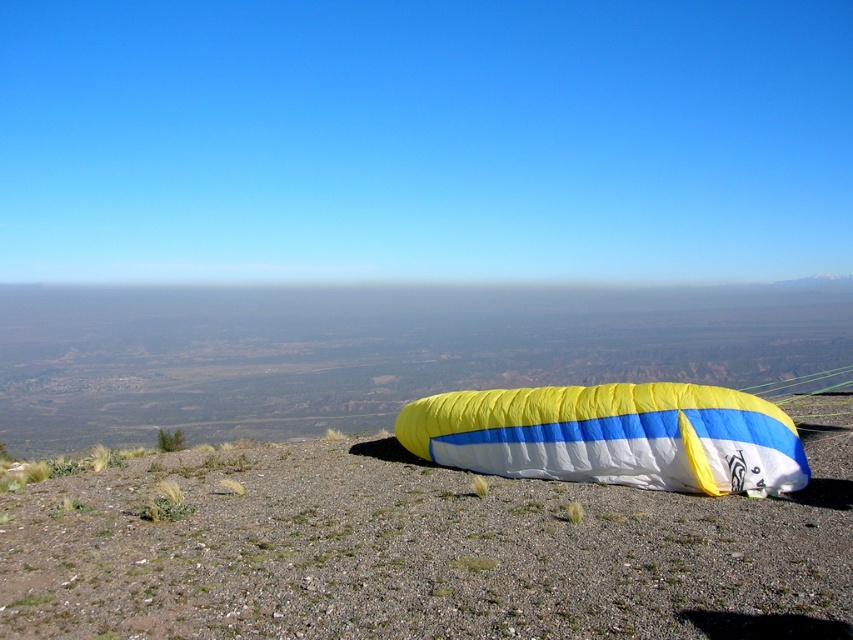
Question: Does yellow fabric parachute at center have a lesser width compared to yellow/white fabric parachute at lower right?

Choices:
 (A) yes
 (B) no

Answer: (A)

Question: Which point appears closest to the camera in this image?

Choices:
 (A) (164, 474)
 (B) (540, 388)

Answer: (B)

Question: Is yellow fabric parachute at center bigger than yellow/white fabric parachute at lower right?

Choices:
 (A) no
 (B) yes

Answer: (A)

Question: Can you confirm if yellow fabric parachute at center is positioned to the right of yellow/white fabric parachute at lower right?

Choices:
 (A) yes
 (B) no

Answer: (B)